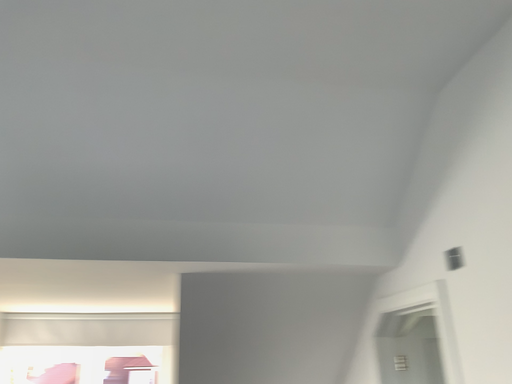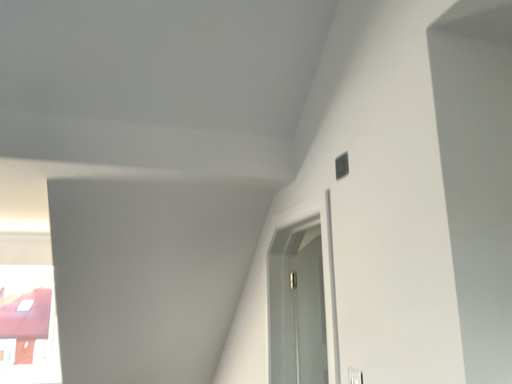
Question: Which way did the camera rotate in the video?

Choices:
 (A) rotated right
 (B) rotated left

Answer: (A)